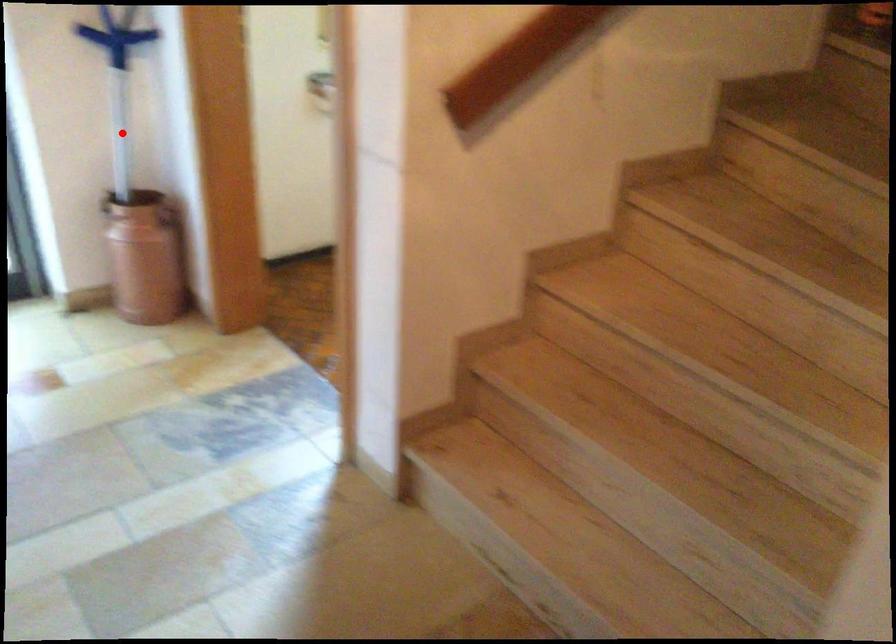
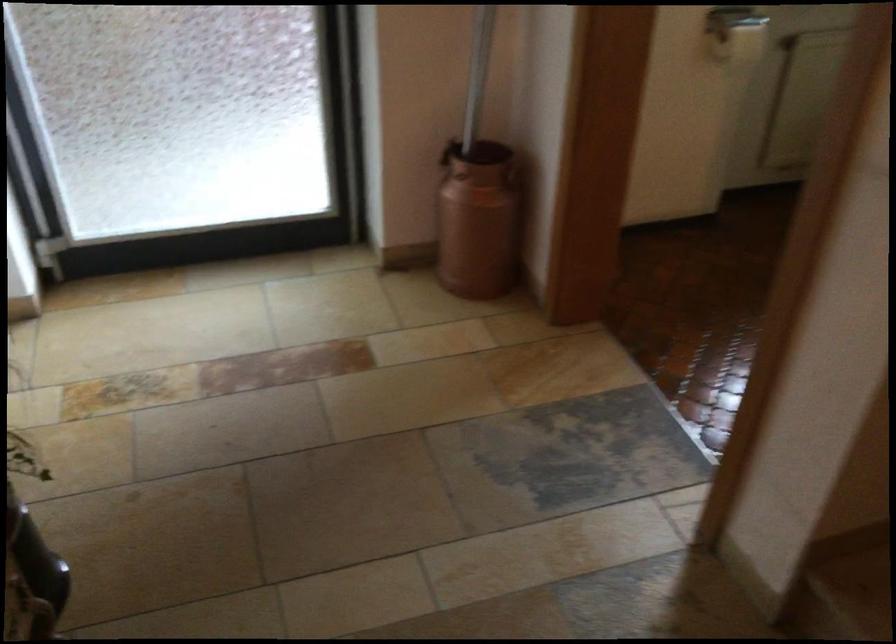
Question: A red point is marked in image1. In image2, is the corresponding 3D point closer to the camera or farther? Reply with the corresponding letter.

Choices:
 (A) The corresponding 3D point is closer.
 (B) The corresponding 3D point is farther.

Answer: (A)